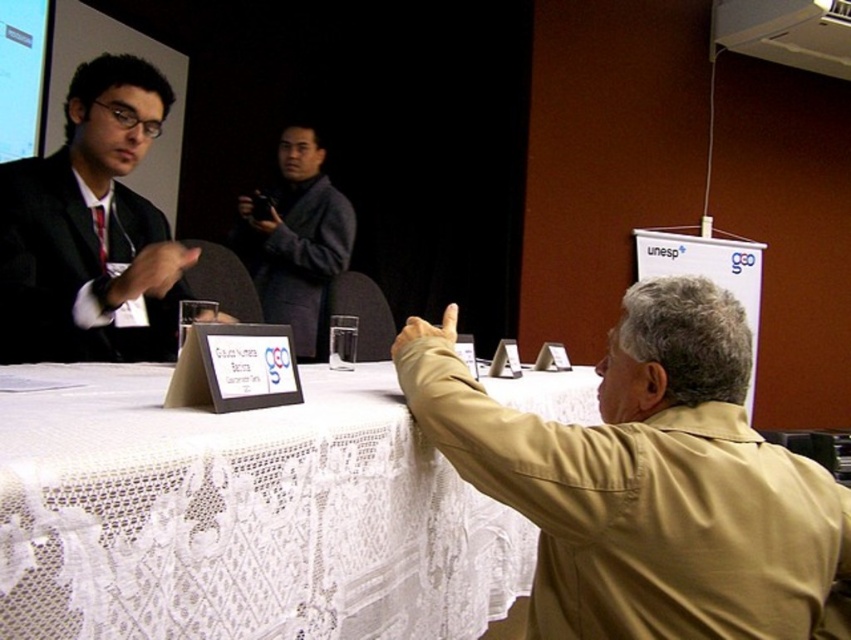
Question: Which point is farther to the camera?

Choices:
 (A) matte white projection screen at upper left
 (B) dark gray suit at center
 (C) khaki leather jacket at upper right
 (D) white lace tablecloth at center

Answer: (A)

Question: Is white lace tablecloth at center to the right of matte black suit at left from the viewer's perspective?

Choices:
 (A) yes
 (B) no

Answer: (A)

Question: Based on their relative distances, which object is nearer to the khaki leather jacket at upper right?

Choices:
 (A) white plastic projector at upper right
 (B) matte white projection screen at upper left

Answer: (B)

Question: Estimate the real-world distances between objects in this image. Which object is closer to the khaki leather jacket at upper right?

Choices:
 (A) dark gray suit at center
 (B) white lace tablecloth at center
 (C) white plastic projector at upper right

Answer: (B)

Question: Does khaki leather jacket at upper right appear on the right side of white plastic projector at upper right?

Choices:
 (A) yes
 (B) no

Answer: (B)

Question: Is white lace tablecloth at center positioned in front of white plastic projector at upper right?

Choices:
 (A) no
 (B) yes

Answer: (B)